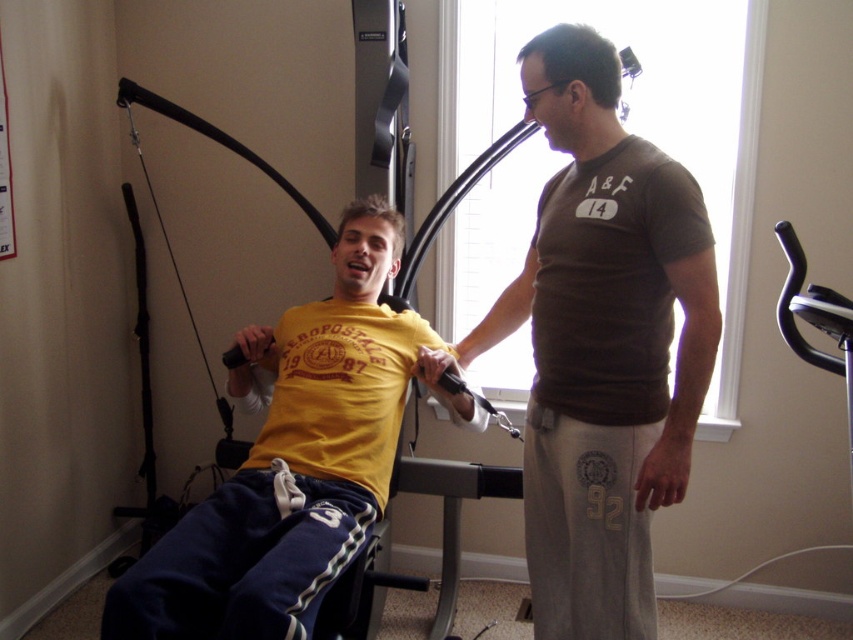
You are standing at the entrance of the home gym. You see two points marked in the room. The first point is at coordinates point (670, 246) and the second point is at point (338, 564). Which point is closer to the entrance?

Point (670, 246) is in front of point (338, 564), so it is closer to the entrance.